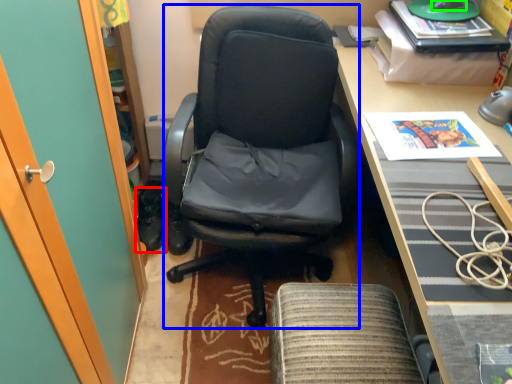
Question: Based on their relative distances, which object is nearer to footwear (highlighted by a red box)? Choose from chair (highlighted by a blue box) and mouse (highlighted by a green box).

Choices:
 (A) chair
 (B) mouse

Answer: (A)